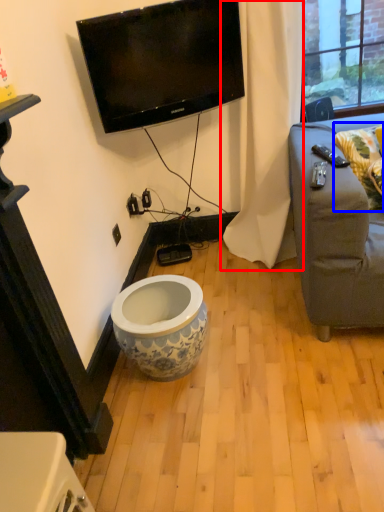
Question: Which object appears closest to the camera in this image, curtain (highlighted by a red box) or pillow (highlighted by a blue box)?

Choices:
 (A) curtain
 (B) pillow

Answer: (A)